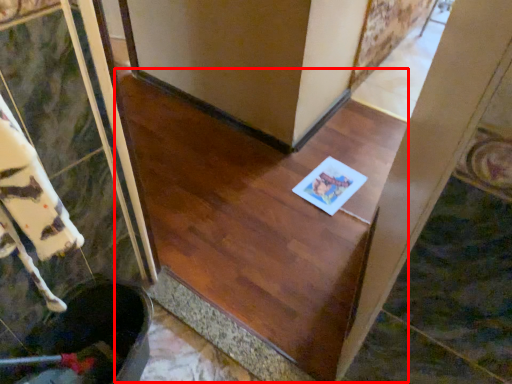
Question: From the image's perspective, where is stairwell (annotated by the red box) located in relation to copy in the image?

Choices:
 (A) below
 (B) above

Answer: (A)